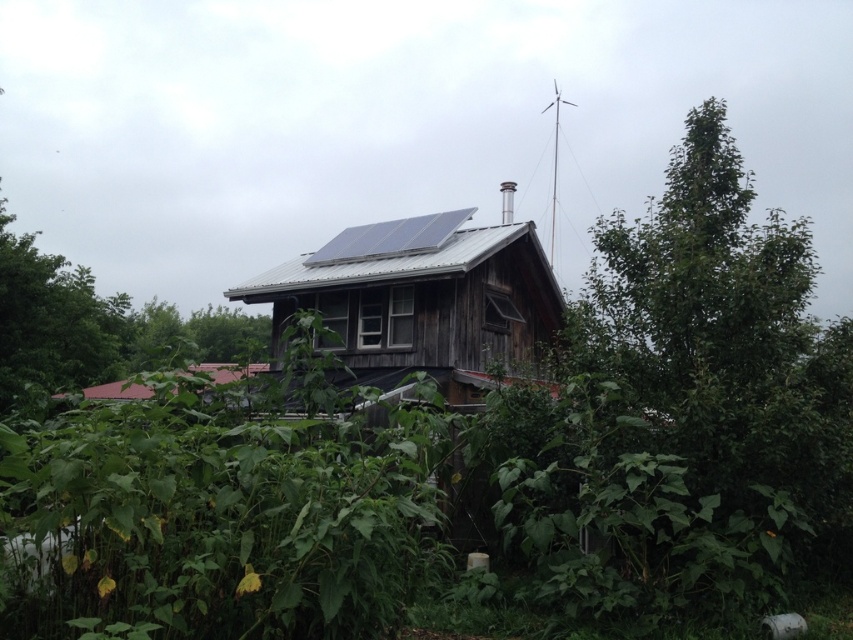
Question: Considering the relative positions of metallic gray hut at center and red tile roof at lower left in the image provided, where is metallic gray hut at center located with respect to red tile roof at lower left?

Choices:
 (A) below
 (B) above

Answer: (B)

Question: Is metallic gray hut at center below blue metallic solar panel at upper center?

Choices:
 (A) yes
 (B) no

Answer: (A)

Question: Considering the real-world distances, which object is farthest from the blue metallic solar panel at upper center?

Choices:
 (A) metallic gray hut at center
 (B) red tile roof at lower left

Answer: (B)

Question: Is metallic gray hut at center positioned before blue metallic solar panel at upper center?

Choices:
 (A) no
 (B) yes

Answer: (B)

Question: Which object appears closest to the camera in this image?

Choices:
 (A) red tile roof at lower left
 (B) blue metallic solar panel at upper center

Answer: (A)

Question: Which object is farther from the camera taking this photo?

Choices:
 (A) blue metallic solar panel at upper center
 (B) red tile roof at lower left
 (C) metallic gray hut at center

Answer: (A)